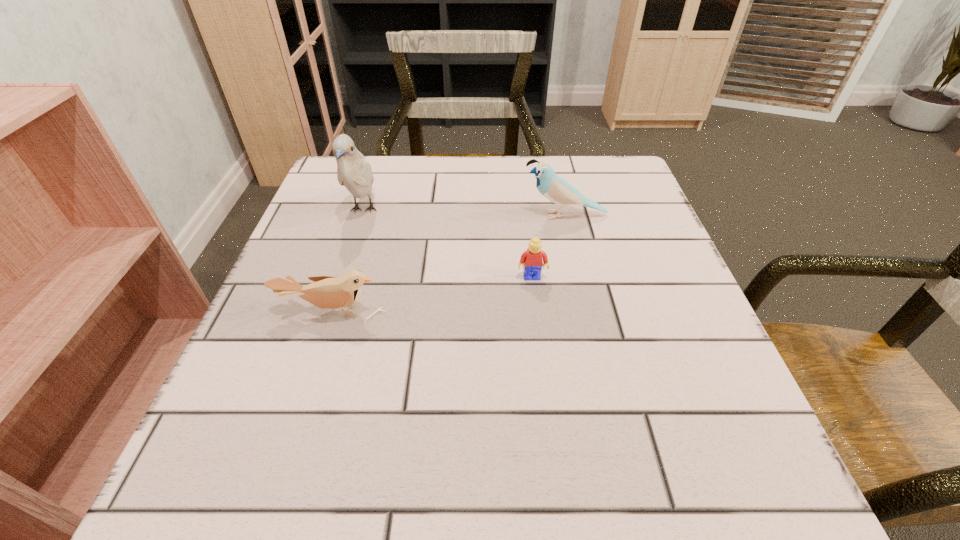
The width and height of the screenshot is (960, 540). What are the coordinates of `vacant area situated 0.230m at the beak of the nearest bird` in the screenshot? It's located at (284, 460).

Where is `free region located 0.330m on the front-facing side of the third farthest object`? The image size is (960, 540). free region located 0.330m on the front-facing side of the third farthest object is located at coordinates (554, 457).

Locate an element on the screen. object that is at the right edge is located at coordinates (557, 190).

The height and width of the screenshot is (540, 960). I want to click on object located at the far left corner, so click(x=354, y=172).

Locate an element on the screen. This screenshot has height=540, width=960. object located at the far right corner is located at coordinates [557, 190].

Where is `blank space at the far edge of the desktop`? Image resolution: width=960 pixels, height=540 pixels. blank space at the far edge of the desktop is located at coordinates (561, 210).

I want to click on free space at the near edge of the desktop, so [369, 492].

Locate an element on the screen. This screenshot has height=540, width=960. free region at the left edge is located at coordinates (204, 437).

Find the location of `vacant space at the right edge of the desktop`. vacant space at the right edge of the desktop is located at coordinates (675, 347).

The height and width of the screenshot is (540, 960). In order to click on vacant space at the far left corner of the desktop in this screenshot , I will do `click(395, 164)`.